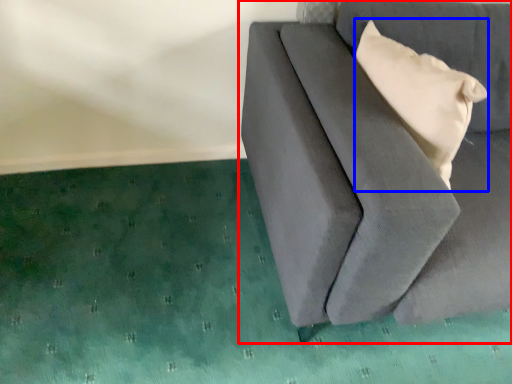
Question: Among these objects, which one is nearest to the camera, furniture (highlighted by a red box) or pillow (highlighted by a blue box)?

Choices:
 (A) furniture
 (B) pillow

Answer: (A)